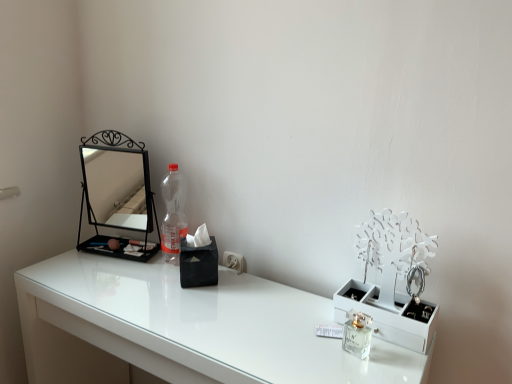
Where is `vacant area on the back side of clear glass perfume at center`? This screenshot has width=512, height=384. vacant area on the back side of clear glass perfume at center is located at coordinates (322, 311).